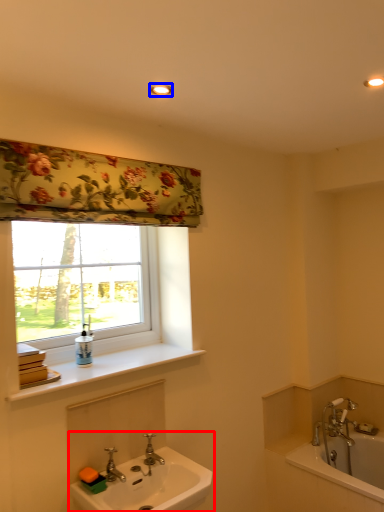
Question: Which of the following is the closest to the observer, sink (highlighted by a red box) or light fixture (highlighted by a blue box)?

Choices:
 (A) sink
 (B) light fixture

Answer: (A)